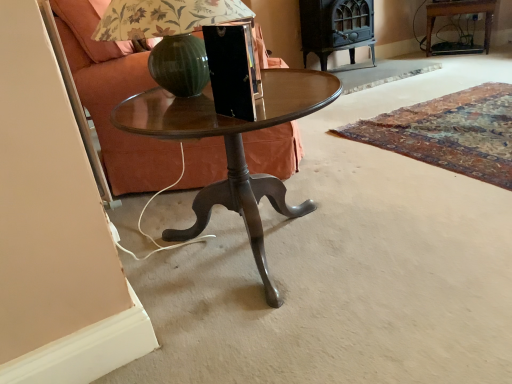
Locate an element on the screen. The height and width of the screenshot is (384, 512). free spot in front of wooden glossy table at center is located at coordinates [x=316, y=336].